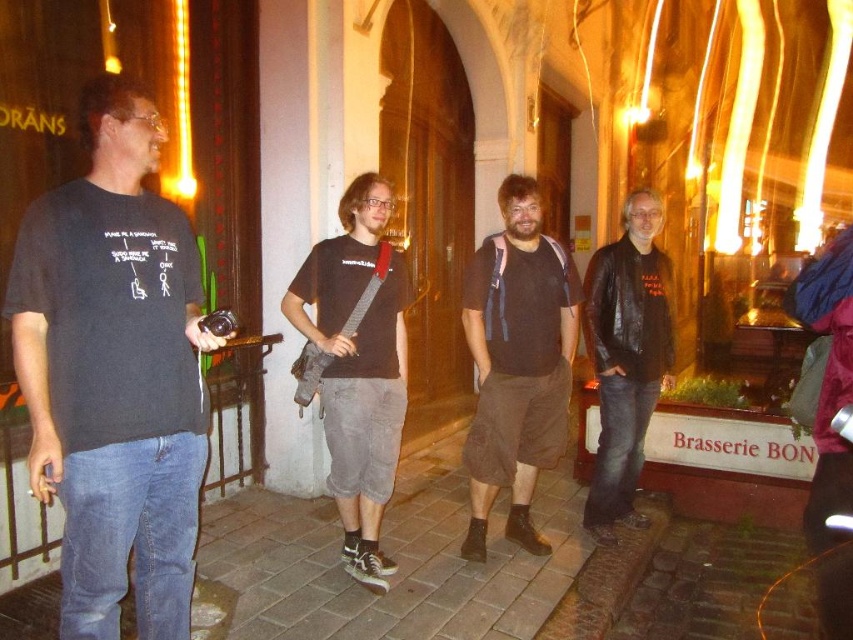
Between dark gray t-shirt at left and brown cotton shorts at center, which one has less height?

dark gray t-shirt at left

In the scene shown: Who is taller, dark gray t-shirt at left or brown cotton shorts at center?

brown cotton shorts at center is taller.

Does point (148, 339) come closer to viewer compared to point (544, 552)?

Yes.

Locate an element on the screen. The image size is (853, 640). dark gray t-shirt at left is located at coordinates (114, 372).

Does dark gray t-shirt at left have a smaller size compared to leather jacket at center?

Indeed, dark gray t-shirt at left has a smaller size compared to leather jacket at center.

Consider the image. Who is more distant from viewer, (x=85, y=476) or (x=584, y=513)?

Positioned behind is point (x=584, y=513).

What are the coordinates of `dark gray t-shirt at left` in the screenshot? It's located at (114, 372).

Where is `dark gray t-shirt at left`? The image size is (853, 640). dark gray t-shirt at left is located at coordinates (114, 372).

Can you confirm if brown brick pavement at lower center is wider than leather jacket at center?

Yes, brown brick pavement at lower center is wider than leather jacket at center.

Does brown brick pavement at lower center appear on the left side of leather jacket at center?

Indeed, brown brick pavement at lower center is positioned on the left side of leather jacket at center.

Is point (56, 625) less distant than point (647, 321)?

Yes, it is.

The width and height of the screenshot is (853, 640). I want to click on brown brick pavement at lower center, so click(x=398, y=561).